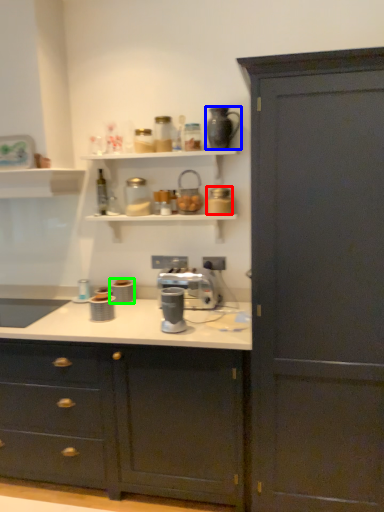
Question: Which is nearer to the appliance (highlighted by a red box)? coffeepot (highlighted by a blue box) or appliance (highlighted by a green box).

Choices:
 (A) coffeepot
 (B) appliance

Answer: (A)